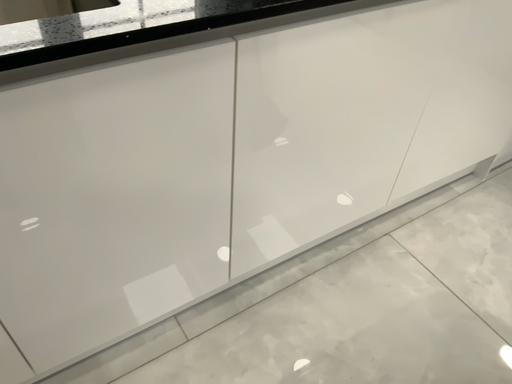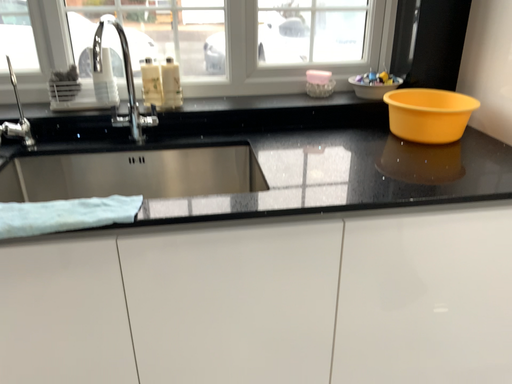
Question: How did the camera likely rotate when shooting the video?

Choices:
 (A) rotated right
 (B) rotated left

Answer: (B)